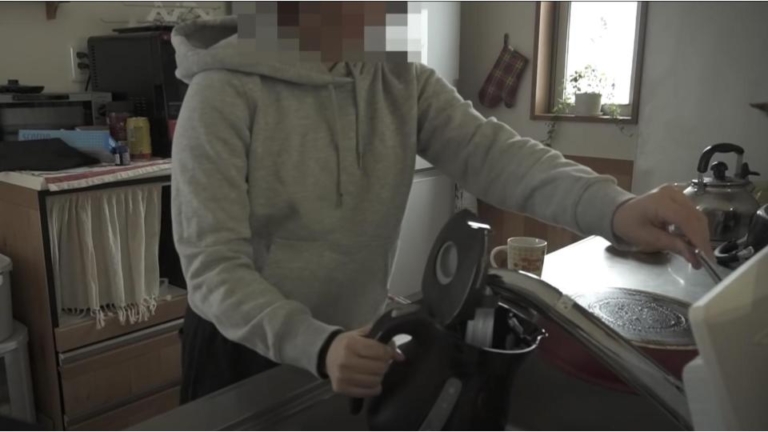
Where is `window`? window is located at coordinates (598, 45).